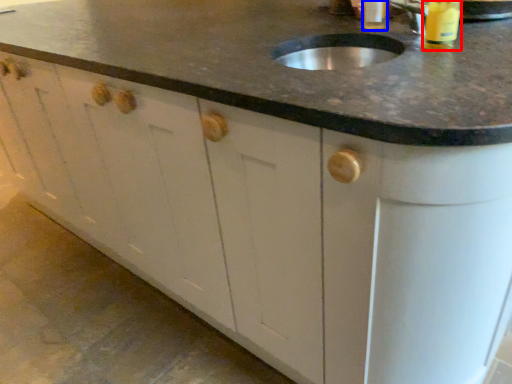
Question: Which point is closer to the camera, beverage (highlighted by a red box) or beverage (highlighted by a blue box)?

Choices:
 (A) beverage
 (B) beverage

Answer: (A)